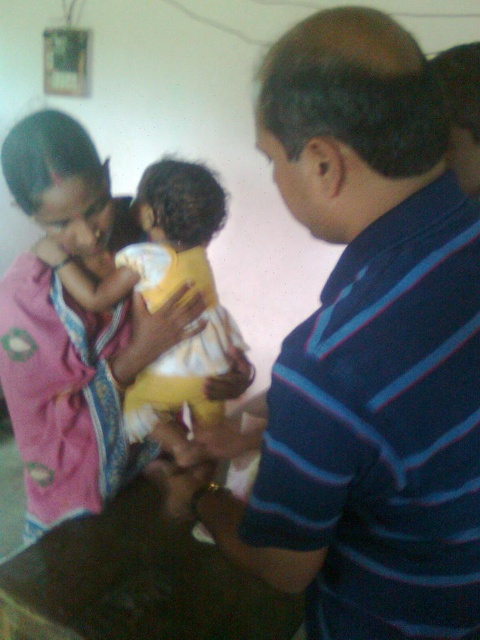
Question: Can you confirm if blue striped shirt at center is positioned below yellow cotton baby at center?

Choices:
 (A) yes
 (B) no

Answer: (A)

Question: Which point is farther to the camera?

Choices:
 (A) (264, 561)
 (B) (204, 417)

Answer: (B)

Question: Which point is farther to the camera?

Choices:
 (A) yellow cotton baby at center
 (B) blue striped shirt at center

Answer: (A)

Question: Can you confirm if blue striped shirt at center is bigger than yellow cotton baby at center?

Choices:
 (A) yes
 (B) no

Answer: (A)

Question: Can you confirm if blue striped shirt at center is thinner than yellow cotton baby at center?

Choices:
 (A) yes
 (B) no

Answer: (A)